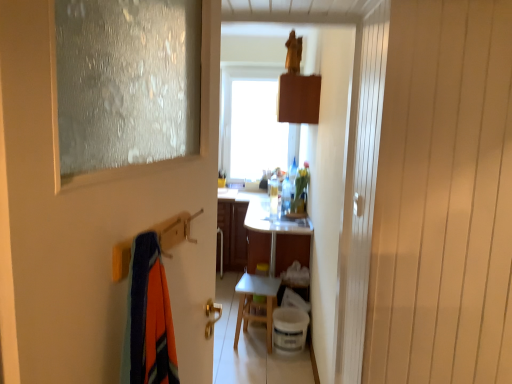
Question: Considering the relative sizes of white glossy vanity at center and frosted glass door at left in the image provided, is white glossy vanity at center taller than frosted glass door at left?

Choices:
 (A) no
 (B) yes

Answer: (A)

Question: Considering the relative sizes of white glossy vanity at center and frosted glass door at left in the image provided, is white glossy vanity at center bigger than frosted glass door at left?

Choices:
 (A) yes
 (B) no

Answer: (A)

Question: Can you confirm if white glossy vanity at center is smaller than frosted glass door at left?

Choices:
 (A) yes
 (B) no

Answer: (B)

Question: Can you confirm if white glossy vanity at center is wider than frosted glass door at left?

Choices:
 (A) no
 (B) yes

Answer: (B)

Question: From the image's perspective, is white glossy vanity at center below frosted glass door at left?

Choices:
 (A) yes
 (B) no

Answer: (A)

Question: Does white glossy vanity at center appear on the left side of frosted glass door at left?

Choices:
 (A) no
 (B) yes

Answer: (A)

Question: Does frosted glass door at left have a lesser width compared to white glossy vanity at center?

Choices:
 (A) yes
 (B) no

Answer: (A)

Question: Can you confirm if frosted glass door at left is shorter than white glossy vanity at center?

Choices:
 (A) yes
 (B) no

Answer: (B)

Question: Is frosted glass door at left closer to camera compared to white glossy vanity at center?

Choices:
 (A) yes
 (B) no

Answer: (A)

Question: Is frosted glass door at left looking in the opposite direction of white glossy vanity at center?

Choices:
 (A) no
 (B) yes

Answer: (A)

Question: Is frosted glass door at left to the left of white glossy vanity at center from the viewer's perspective?

Choices:
 (A) no
 (B) yes

Answer: (B)

Question: From a real-world perspective, does frosted glass door at left stand above white glossy vanity at center?

Choices:
 (A) no
 (B) yes

Answer: (B)

Question: Considering the relative sizes of translucent plastic bottle at center and frosted glass door at left in the image provided, is translucent plastic bottle at center smaller than frosted glass door at left?

Choices:
 (A) no
 (B) yes

Answer: (B)